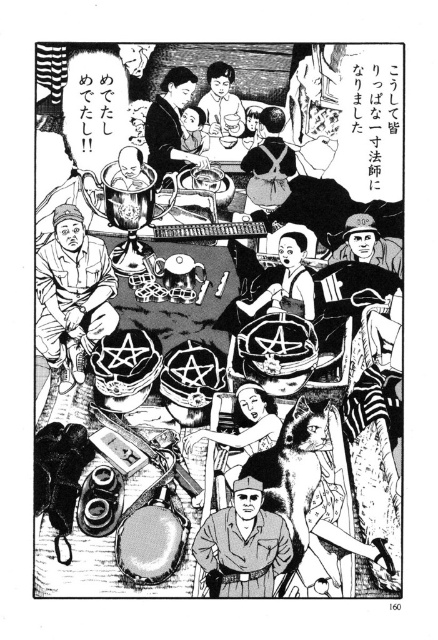
You are a character in the scene who needs to grab both the matte black helmet at center and the smooth porcelain cup at upper center quickly. Given that you can only move in a straight line, which object will you reach first if you start moving towards them from your current position?

The matte black helmet at center will be reached first because it is closer to your starting position than the smooth porcelain cup at upper center, which is 4.06 meters away from the helmet.

You are a delivery person who needs to place a package between the matte black backpack at upper center and the matte black apron at center. The package requires a space of 8 feet. Is there enough space between them?

The distance between the matte black backpack at upper center and the matte black apron at center is 7.60 feet, which is less than the required 8 feet. Therefore, there isn not enough space to place the package between them.

You are a guest at this event and need to choose between taking the matte black helmet at lower left or the matte black apron at center. Which item would you have more difficulty carrying due to its size?

The matte black helmet at lower left is larger in size than the matte black apron at center, so it would be more difficult to carry due to its larger size.